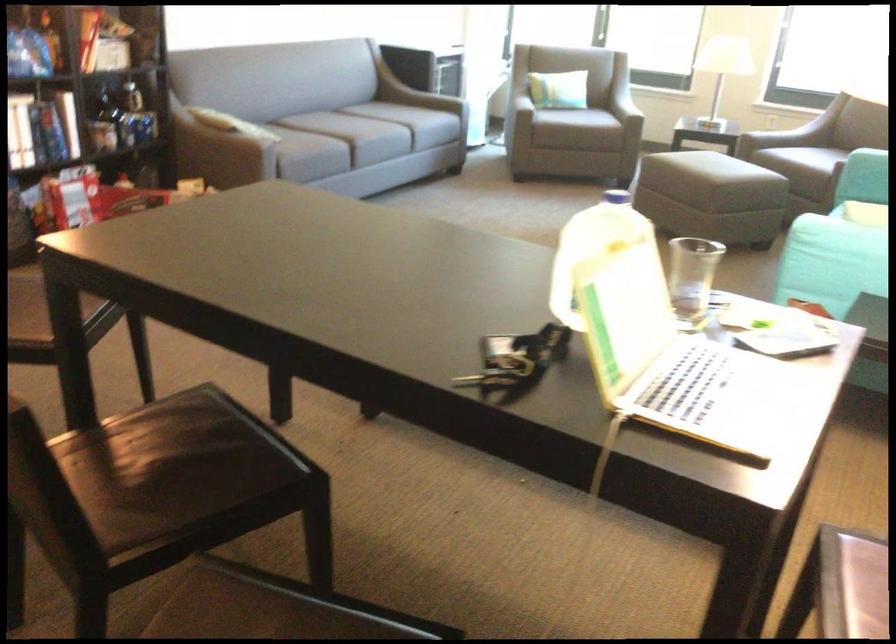
This screenshot has height=644, width=896. Identify the location of plastic jug. (591, 247).